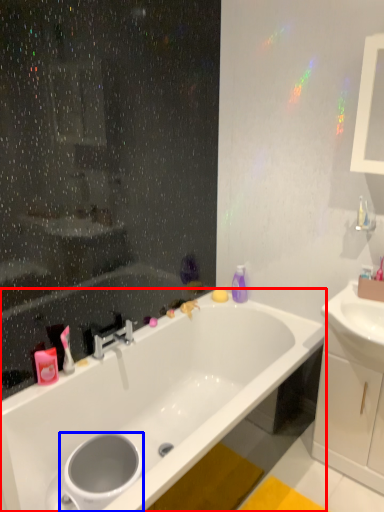
Question: Which object appears farthest to the camera in this image, bathtub (highlighted by a red box) or toilet bowl (highlighted by a blue box)?

Choices:
 (A) bathtub
 (B) toilet bowl

Answer: (B)